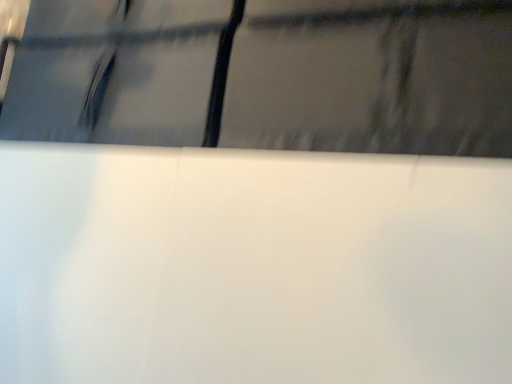
Find the location of `white glossy window at upper center`. white glossy window at upper center is located at coordinates (266, 75).

What is the approximate width of white glossy window at upper center?

white glossy window at upper center is 13.28 inches in width.

Describe the element at coordinates (266, 75) in the screenshot. I see `white glossy window at upper center` at that location.

Find the location of a particular element. This screenshot has height=384, width=512. white glossy window at upper center is located at coordinates (266, 75).